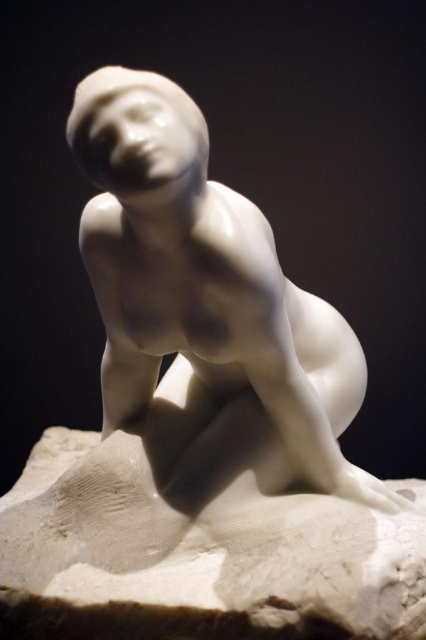
Question: Does white glossy statue at center appear over white marble base at lower center?

Choices:
 (A) no
 (B) yes

Answer: (B)

Question: Does white glossy statue at center appear on the right side of white marble base at lower center?

Choices:
 (A) no
 (B) yes

Answer: (B)

Question: Which object is farther from the camera taking this photo?

Choices:
 (A) white marble base at lower center
 (B) white glossy statue at center

Answer: (A)

Question: Which object is closer to the camera taking this photo?

Choices:
 (A) white glossy statue at center
 (B) white marble base at lower center

Answer: (A)

Question: From the image, what is the correct spatial relationship of white glossy statue at center in relation to white marble base at lower center?

Choices:
 (A) below
 (B) above

Answer: (B)